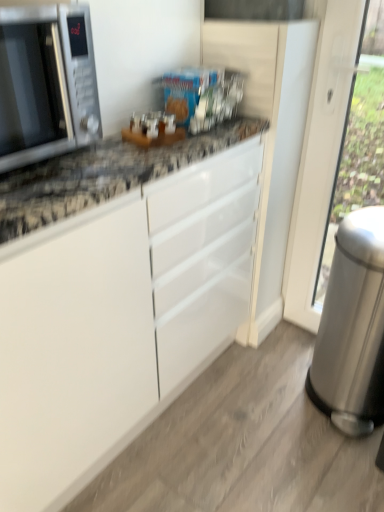
This screenshot has width=384, height=512. Identify the location of vacant space in front of silver metallic trash can at right. (329, 467).